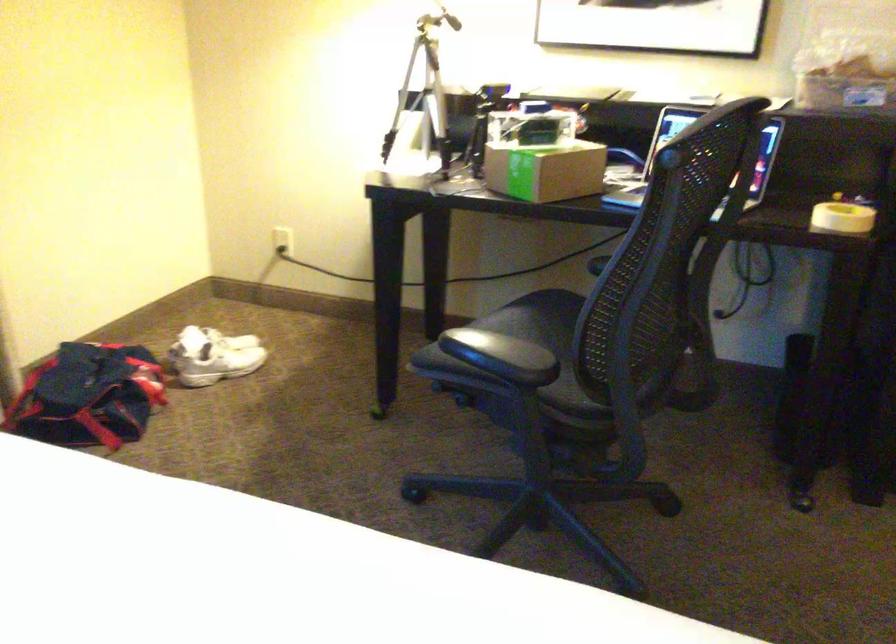
What do you see at coordinates (556, 307) in the screenshot? I see `the chair sitting surface` at bounding box center [556, 307].